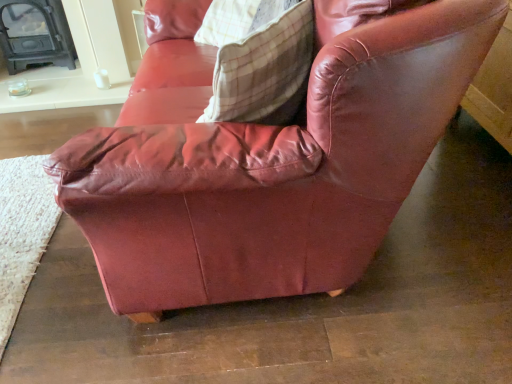
The width and height of the screenshot is (512, 384). What do you see at coordinates (264, 66) in the screenshot?
I see `plaid fabric pillow at upper center` at bounding box center [264, 66].

Locate an element on the screen. This screenshot has width=512, height=384. plaid fabric pillow at upper center is located at coordinates (264, 66).

This screenshot has width=512, height=384. I want to click on matte black fireplace at left, so click(35, 34).

What do you see at coordinates (35, 34) in the screenshot? This screenshot has width=512, height=384. I see `matte black fireplace at left` at bounding box center [35, 34].

Image resolution: width=512 pixels, height=384 pixels. What are the coordinates of `plaid fabric pillow at upper center` in the screenshot? It's located at (264, 66).

Considering the positions of objects plaid fabric pillow at upper center and matte black fireplace at left in the image provided, who is more to the right, plaid fabric pillow at upper center or matte black fireplace at left?

plaid fabric pillow at upper center.

Relative to matte black fireplace at left, is plaid fabric pillow at upper center in front or behind?

Visually, plaid fabric pillow at upper center is located in front of matte black fireplace at left.

Which point is more forward, (236, 66) or (16, 10)?

The point (236, 66) is more forward.

From the image's perspective, which is below, plaid fabric pillow at upper center or matte black fireplace at left?

plaid fabric pillow at upper center is shown below in the image.

From a real-world perspective, which is physically above, plaid fabric pillow at upper center or matte black fireplace at left?

From a 3D spatial view, plaid fabric pillow at upper center is above.

Is plaid fabric pillow at upper center thinner than matte black fireplace at left?

Yes.

From the picture: Is plaid fabric pillow at upper center shorter than matte black fireplace at left?

Correct, plaid fabric pillow at upper center is not as tall as matte black fireplace at left.

Between plaid fabric pillow at upper center and matte black fireplace at left, which one has larger size?

matte black fireplace at left.

Is plaid fabric pillow at upper center situated inside matte black fireplace at left or outside?

plaid fabric pillow at upper center is outside matte black fireplace at left.

Based on the photo, is plaid fabric pillow at upper center not near matte black fireplace at left?

plaid fabric pillow at upper center is far away from matte black fireplace at left.

Is plaid fabric pillow at upper center facing away from matte black fireplace at left?

plaid fabric pillow at upper center is not turned away from matte black fireplace at left.

From the picture: What's the angular difference between plaid fabric pillow at upper center and matte black fireplace at left's facing directions?

plaid fabric pillow at upper center and matte black fireplace at left are facing 50.8 degrees away from each other.

Image resolution: width=512 pixels, height=384 pixels. In order to click on fireplace above the plaid fabric pillow at upper center (from the image's perspective) in this screenshot , I will do `click(35, 34)`.

Is matte black fireplace at left to the left of plaid fabric pillow at upper center from the viewer's perspective?

Correct, you'll find matte black fireplace at left to the left of plaid fabric pillow at upper center.

In the scene shown: Is matte black fireplace at left in front of or behind plaid fabric pillow at upper center in the image?

matte black fireplace at left is behind plaid fabric pillow at upper center.

Which is in front, point (2, 14) or point (245, 91)?

The point (245, 91) is more forward.

From the image's perspective, between matte black fireplace at left and plaid fabric pillow at upper center, which one is located above?

matte black fireplace at left.

From a real-world perspective, which object rests below the other?

matte black fireplace at left, from a real-world perspective.

Does matte black fireplace at left have a lesser width compared to plaid fabric pillow at upper center?

Incorrect, the width of matte black fireplace at left is not less than that of plaid fabric pillow at upper center.

Between matte black fireplace at left and plaid fabric pillow at upper center, which one has more height?

Standing taller between the two is matte black fireplace at left.

Can you confirm if matte black fireplace at left is smaller than plaid fabric pillow at upper center?

Incorrect, matte black fireplace at left is not smaller in size than plaid fabric pillow at upper center.

Is plaid fabric pillow at upper center completely or partially inside matte black fireplace at left?

No, matte black fireplace at left does not contain plaid fabric pillow at upper center.

Are matte black fireplace at left and plaid fabric pillow at upper center located far from each other?

Indeed, matte black fireplace at left is not near plaid fabric pillow at upper center.

Is matte black fireplace at left facing towards plaid fabric pillow at upper center?

No, matte black fireplace at left does not turn towards plaid fabric pillow at upper center.

What's the angular difference between matte black fireplace at left and plaid fabric pillow at upper center's facing directions?

The angle between the facing direction of matte black fireplace at left and the facing direction of plaid fabric pillow at upper center is 50.8 degrees.

Locate an element on the screen. fireplace on the left of plaid fabric pillow at upper center is located at coordinates (35, 34).

The height and width of the screenshot is (384, 512). I want to click on fireplace on the left side of plaid fabric pillow at upper center, so click(35, 34).

The width and height of the screenshot is (512, 384). Find the location of `throw pillow that appears on the right of matte black fireplace at left`. throw pillow that appears on the right of matte black fireplace at left is located at coordinates coord(264,66).